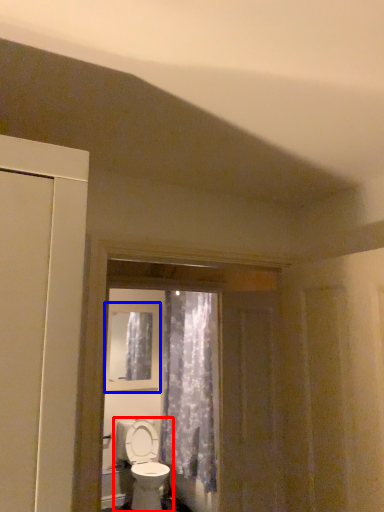
Question: Among these objects, which one is farthest to the camera, toilet (highlighted by a red box) or window (highlighted by a blue box)?

Choices:
 (A) toilet
 (B) window

Answer: (B)